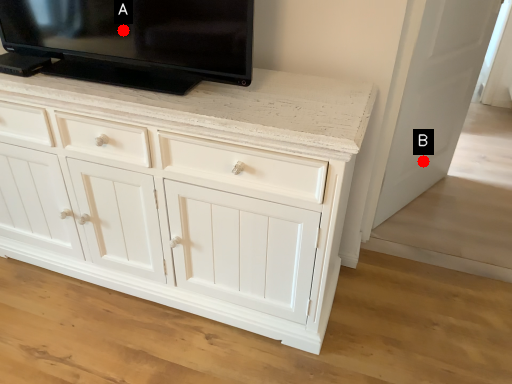
Question: Two points are circled on the image, labeled by A and B beside each circle. Which point is farther from the camera taking this photo?

Choices:
 (A) A is further
 (B) B is further

Answer: (B)